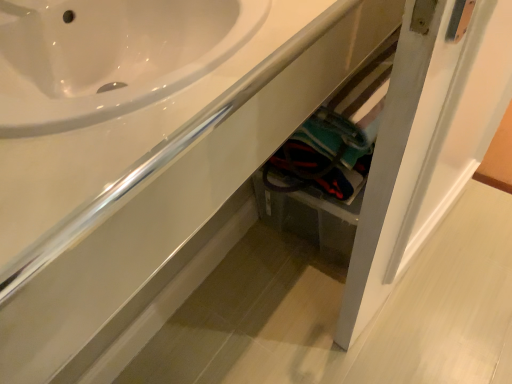
Image resolution: width=512 pixels, height=384 pixels. I want to click on vacant space positioned to the left of white glossy door at lower right, so click(263, 298).